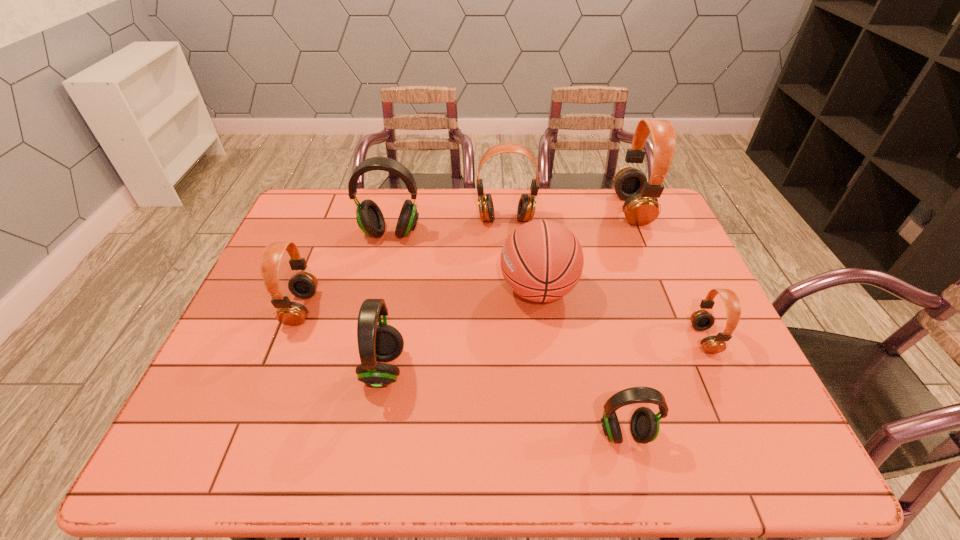
You are a GUI agent. You are given a task and a screenshot of the screen. Output one action in this format:
    pyautogui.click(x=<x>, y=<y>)
    Task: Click on the tallest object
    Image resolution: width=960 pixels, height=540 pixels.
    Given the screenshot: What is the action you would take?
    pyautogui.click(x=641, y=207)

Find the location of a particular element. The image size is (960, 540). the biggest brown headset is located at coordinates [x=641, y=207].

Where is `the biggest black headset`? the biggest black headset is located at coordinates (370, 219).

I want to click on the third brown headset from right to left, so pyautogui.click(x=527, y=204).

You are a GUI agent. You are given a task and a screenshot of the screen. Output one action in this format:
    pyautogui.click(x=<x>, y=<y>)
    Task: Click on the fourth headset from right to left
    This screenshot has height=540, width=960.
    Given the screenshot: What is the action you would take?
    pyautogui.click(x=527, y=204)

At what (x,y) coordinates should I click in order to perform the action: click on basketball. Please return your answer as a coordinate pair (x, y). The width and height of the screenshot is (960, 540). Looking at the image, I should click on (542, 260).

At what (x,y) coordinates should I click in order to perform the action: click on the leftmost brown headset. Please return your answer as a coordinate pair (x, y). The height and width of the screenshot is (540, 960). Looking at the image, I should click on (303, 284).

The height and width of the screenshot is (540, 960). In order to click on the leftmost headset in this screenshot , I will do `click(303, 284)`.

Locate an element on the screen. Image resolution: width=960 pixels, height=540 pixels. the second biggest black headset is located at coordinates (383, 342).

What are the coordinates of `the smallest brown headset` in the screenshot? It's located at (701, 320).